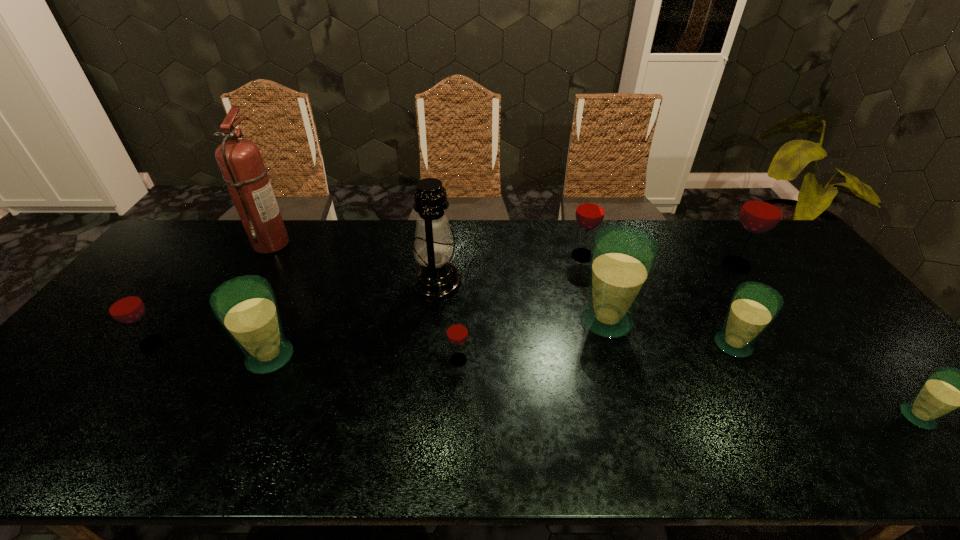
You are a GUI agent. You are given a task and a screenshot of the screen. Output one action in this format:
    pyautogui.click(x=<x>, y=<y>)
    Task: Click on the tallest object
    The height and width of the screenshot is (540, 960).
    Given the screenshot: What is the action you would take?
    pyautogui.click(x=240, y=161)

Where is `fire extinguisher`? The image size is (960, 540). fire extinguisher is located at coordinates (240, 161).

Locate an element on the screen. The width and height of the screenshot is (960, 540). the second tallest object is located at coordinates (434, 247).

Where is `oil lamp`? The image size is (960, 540). oil lamp is located at coordinates click(x=434, y=247).

Find the location of `the biggest red glass`. the biggest red glass is located at coordinates (762, 210).

At what (x,y) coordinates should I click in order to perform the action: click on the ninth object from left to right. Please return your answer as a coordinate pair (x, y). Looking at the image, I should click on (762, 210).

Find the location of a particular element. This screenshot has width=960, height=540. the biggest blue glass is located at coordinates (622, 259).

You are a GUI agent. You are given a task and a screenshot of the screen. Output one action in this format:
    pyautogui.click(x=<x>, y=<y>)
    Task: Click on the second red glass from right to left
    The height and width of the screenshot is (540, 960).
    Given the screenshot: What is the action you would take?
    pyautogui.click(x=590, y=211)

Where is `the third smallest blue glass`? the third smallest blue glass is located at coordinates (246, 307).

The width and height of the screenshot is (960, 540). I want to click on the third object from left to right, so click(246, 307).